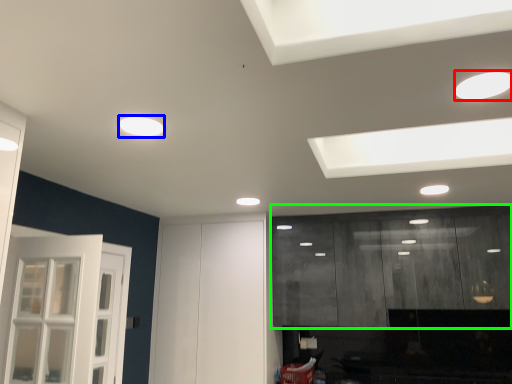
Question: Which object is the farthest from lighting (highlighted by a red box)? Choose among these: lighting (highlighted by a blue box) or cabinetry (highlighted by a green box).

Choices:
 (A) lighting
 (B) cabinetry

Answer: (B)